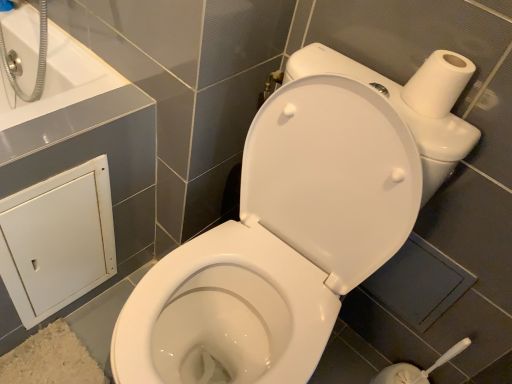
The width and height of the screenshot is (512, 384). What do you see at coordinates (60, 80) in the screenshot? I see `white glossy bathtub at upper left` at bounding box center [60, 80].

You are a GUI agent. You are given a task and a screenshot of the screen. Output one action in this format:
    pyautogui.click(x=<x>, y=<y>)
    Task: Click on the white matte toilet paper at upper right
    Image resolution: width=512 pixels, height=384 pixels.
    Given the screenshot: What is the action you would take?
    pyautogui.click(x=438, y=83)

What is the approximate height of white glossy toilet at center?

white glossy toilet at center is 30.64 inches tall.

The height and width of the screenshot is (384, 512). Describe the element at coordinates (281, 242) in the screenshot. I see `white glossy toilet at center` at that location.

This screenshot has height=384, width=512. What do you see at coordinates (419, 283) in the screenshot?
I see `dark gray tile at lower right` at bounding box center [419, 283].

This screenshot has width=512, height=384. What are the coordinates of `white glossy bathtub at upper left` in the screenshot? It's located at (60, 80).

Is white glossy toilet at center facing away from dark gray tile at lower right?

Yes, white glossy toilet at center is facing away from dark gray tile at lower right.

In terms of height, does white glossy toilet at center look taller or shorter compared to dark gray tile at lower right?

Considering their sizes, white glossy toilet at center has more height than dark gray tile at lower right.

Is white glossy toilet at center not inside dark gray tile at lower right?

Absolutely, white glossy toilet at center is external to dark gray tile at lower right.

Is white glossy toilet at center thinner than dark gray tile at lower right?

In fact, white glossy toilet at center might be wider than dark gray tile at lower right.

Which object is thinner, dark gray tile at lower right or white glossy bathtub at upper left?

dark gray tile at lower right is thinner.

Identify the location of bath that appears above the dark gray tile at lower right (from the image's perspective). (60, 80).

Is dark gray tile at lower right oriented towards white glossy bathtub at upper left?

No, dark gray tile at lower right is not oriented towards white glossy bathtub at upper left.

Considering the positions of objects dark gray tile at lower right and white glossy bathtub at upper left in the image provided, who is behind, dark gray tile at lower right or white glossy bathtub at upper left?

dark gray tile at lower right is more distant.

At what (x,y) coordinates should I click in order to perform the action: click on screen door below the white matte toilet paper at upper right (from the image's perspective). Please return your answer as a coordinate pair (x, y). The width and height of the screenshot is (512, 384). Looking at the image, I should click on (57, 240).

Is the depth of white matte cabinet at lower left less than that of white matte toilet paper at upper right?

No, the depth of white matte cabinet at lower left is greater than that of white matte toilet paper at upper right.

Does white matte cabinet at lower left have a lesser height compared to white matte toilet paper at upper right?

In fact, white matte cabinet at lower left may be taller than white matte toilet paper at upper right.

Considering the relative sizes of white matte cabinet at lower left and white matte toilet paper at upper right in the image provided, is white matte cabinet at lower left thinner than white matte toilet paper at upper right?

Indeed, white matte cabinet at lower left has a lesser width compared to white matte toilet paper at upper right.

Relative to white matte toilet paper at upper right, is white glossy bathtub at upper left in front or behind?

In the image, white glossy bathtub at upper left appears behind white matte toilet paper at upper right.

How many degrees apart are the facing directions of white glossy bathtub at upper left and white matte toilet paper at upper right?

The angular difference between white glossy bathtub at upper left and white matte toilet paper at upper right is 0.891 degrees.

Is white glossy bathtub at upper left next to white matte toilet paper at upper right?

No, white glossy bathtub at upper left is not beside white matte toilet paper at upper right.

Considering the sizes of objects dark gray tile at lower right and white matte toilet paper at upper right in the image provided, who is shorter, dark gray tile at lower right or white matte toilet paper at upper right?

Standing shorter between the two is white matte toilet paper at upper right.

Is dark gray tile at lower right spatially inside white matte toilet paper at upper right, or outside of it?

dark gray tile at lower right is outside white matte toilet paper at upper right.

Is white matte toilet paper at upper right at the back of dark gray tile at lower right?

No, dark gray tile at lower right's orientation is not away from white matte toilet paper at upper right.

Which point is more forward, (411, 237) or (455, 80)?

The point (455, 80) is more forward.

From a real-world perspective, between white matte toilet paper at upper right and white glossy bathtub at upper left, who is vertically lower?

white glossy bathtub at upper left, from a real-world perspective.

Can we say white matte toilet paper at upper right lies outside white glossy bathtub at upper left?

white matte toilet paper at upper right is positioned outside white glossy bathtub at upper left.

Is white matte toilet paper at upper right at the left side of white glossy bathtub at upper left?

Incorrect, white matte toilet paper at upper right is not on the left side of white glossy bathtub at upper left.

From the image's perspective, which is below, white matte toilet paper at upper right or white matte cabinet at lower left?

white matte cabinet at lower left appears lower in the image.

Looking at this image, considering the sizes of objects white matte toilet paper at upper right and white matte cabinet at lower left in the image provided, who is taller, white matte toilet paper at upper right or white matte cabinet at lower left?

white matte cabinet at lower left.

Which is less distant, [459,74] or [92,241]?

Point [459,74] is positioned closer to the camera compared to point [92,241].

Which of these two, white matte toilet paper at upper right or white matte cabinet at lower left, is wider?

Wider between the two is white matte toilet paper at upper right.

In the image, there is a white glossy toilet at center. Identify the location of square below it (from a real-world perspective). The height and width of the screenshot is (384, 512). (419, 283).

This screenshot has width=512, height=384. Identify the location of square located below the white glossy bathtub at upper left (from the image's perspective). (419, 283).

Looking at the image, which one is located closer to white glossy toilet at center, dark gray tile at lower right or white matte toilet paper at upper right?

The object closer to white glossy toilet at center is dark gray tile at lower right.

When comparing their distances from white matte toilet paper at upper right, does white glossy toilet at center or white glossy bathtub at upper left seem closer?

white glossy toilet at center lies closer to white matte toilet paper at upper right than the other object.

Which object lies further to the anchor point white glossy bathtub at upper left, white glossy toilet at center or white matte cabinet at lower left?

white glossy toilet at center is further to white glossy bathtub at upper left.

Which object lies further to the anchor point white glossy bathtub at upper left, white matte cabinet at lower left or white glossy toilet at center?

Based on the image, white glossy toilet at center appears to be further to white glossy bathtub at upper left.

When comparing their distances from white matte toilet paper at upper right, does white glossy bathtub at upper left or dark gray tile at lower right seem closer?

dark gray tile at lower right.

Based on their spatial positions, is dark gray tile at lower right or white matte toilet paper at upper right further from white matte cabinet at lower left?

white matte toilet paper at upper right.

Estimate the real-world distances between objects in this image. Which object is further from white glossy bathtub at upper left, dark gray tile at lower right or white matte toilet paper at upper right?

dark gray tile at lower right.

Based on their spatial positions, is white glossy toilet at center or white matte toilet paper at upper right further from white matte cabinet at lower left?

Among the two, white matte toilet paper at upper right is located further to white matte cabinet at lower left.

Locate an element on the screen. Image resolution: width=512 pixels, height=384 pixels. toilet paper between white glossy bathtub at upper left and dark gray tile at lower right is located at coordinates (438, 83).

Identify the location of screen door located between white glossy bathtub at upper left and white matte toilet paper at upper right in the left-right direction. This screenshot has height=384, width=512. (57, 240).

Identify the location of toilet situated between white matte cabinet at lower left and white matte toilet paper at upper right from left to right. (281, 242).

Locate an element on the screen. The width and height of the screenshot is (512, 384). toilet between white glossy bathtub at upper left and dark gray tile at lower right from left to right is located at coordinates (281, 242).